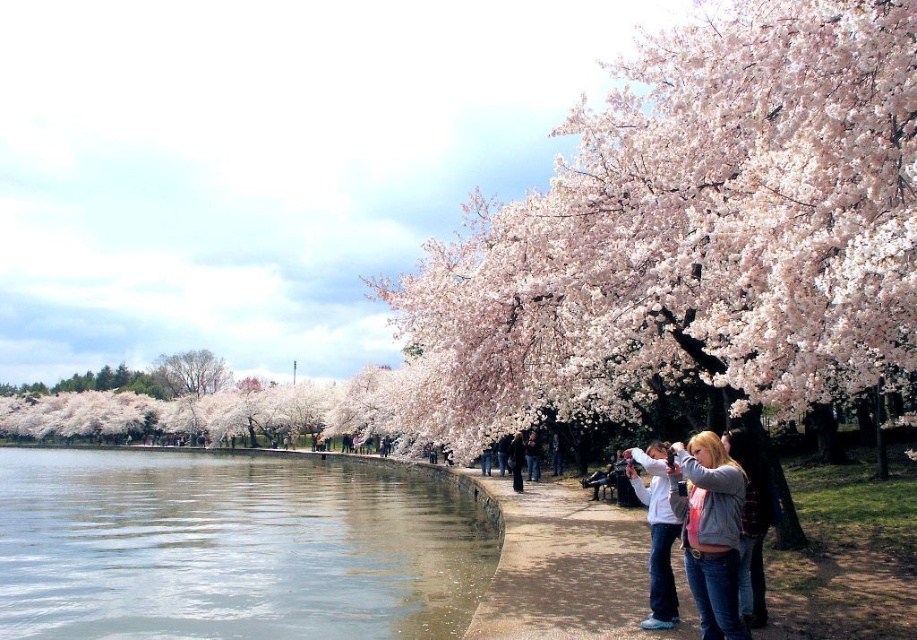
You are a photographer planning to take a picture of the clear water at lower left and the denim jacket at lower center. Which object will occupy more space in the photo?

The clear water at lower left will occupy more space in the photo because its width is larger than the denim jacket at lower center.

Looking at this image, you are a photographer standing at the edge of the water in the park. You want to place your tripod so that both the clear water at lower left and the denim jacket at lower center are in the frame. Which object should you position closer to the left side of your camera viewfinder?

The clear water at lower left is positioned on the left side of the denim jacket at lower center, so you should place the clear water at lower left closer to the left side of your camera viewfinder to ensure both are in frame.

You are a photographer planning to capture a reflection shot of the clear water at lower left and the smooth bark tree at left. Since you want the tree to appear to the left of the water in the photo, will the current arrangement allow this?

The clear water at lower left is positioned on the right side of smooth bark tree at left, so the tree is already to the left of the water. This arrangement allows the tree to appear to the left of the water in the photo as desired.